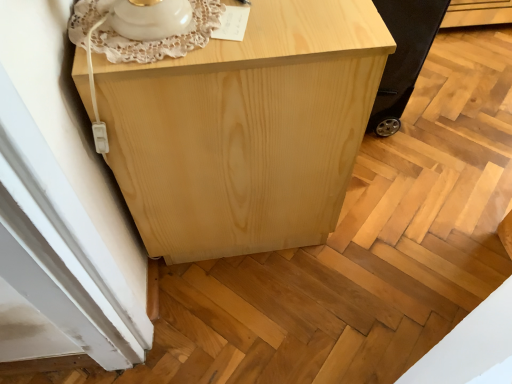
Question: Looking at their shapes, would you say natural wood cabinet at center is wider or thinner than black rubber wheel at lower right?

Choices:
 (A) wide
 (B) thin

Answer: (A)

Question: From a real-world perspective, is natural wood cabinet at center above or below black rubber wheel at lower right?

Choices:
 (A) above
 (B) below

Answer: (A)

Question: From the image's perspective, is natural wood cabinet at center above or below black rubber wheel at lower right?

Choices:
 (A) above
 (B) below

Answer: (B)

Question: Is point (431, 6) positioned closer to the camera than point (305, 28)?

Choices:
 (A) farther
 (B) closer

Answer: (A)

Question: Is black rubber wheel at lower right inside the boundaries of natural wood cabinet at center, or outside?

Choices:
 (A) outside
 (B) inside

Answer: (A)

Question: In terms of width, does black rubber wheel at lower right look wider or thinner when compared to natural wood cabinet at center?

Choices:
 (A) wide
 (B) thin

Answer: (B)

Question: From the image's perspective, relative to natural wood cabinet at center, is black rubber wheel at lower right above or below?

Choices:
 (A) below
 (B) above

Answer: (B)